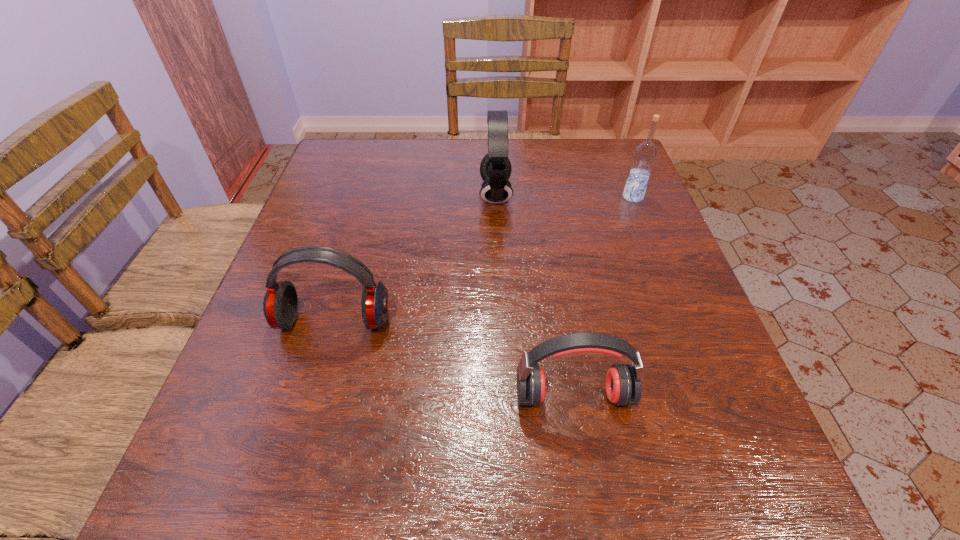
You are a GUI agent. You are given a task and a screenshot of the screen. Output one action in this format:
    pyautogui.click(x=<x>, y=<y>)
    Task: Click on the vodka
    
    Given the screenshot: What is the action you would take?
    pyautogui.click(x=645, y=154)

I want to click on the farthest earphone, so click(495, 169).

Image resolution: width=960 pixels, height=540 pixels. What are the coordinates of `the leftmost earphone` in the screenshot? It's located at (280, 305).

The height and width of the screenshot is (540, 960). In order to click on the second nearest earphone in this screenshot , I will do `click(280, 305)`.

The width and height of the screenshot is (960, 540). In order to click on the nearest earphone in this screenshot , I will do `click(623, 382)`.

I want to click on blank space located on the back of the rightmost object, so click(617, 158).

Locate an element on the screen. The height and width of the screenshot is (540, 960). free space located 0.150m on the ear cups of the farthest earphone is located at coordinates (420, 194).

The image size is (960, 540). I want to click on free space located on the ear cups of the farthest earphone, so click(x=339, y=194).

This screenshot has width=960, height=540. I want to click on free space located 0.140m on the ear cups of the farthest earphone, so click(x=425, y=194).

I want to click on free point located on the ear cups of the leftmost earphone, so click(x=306, y=416).